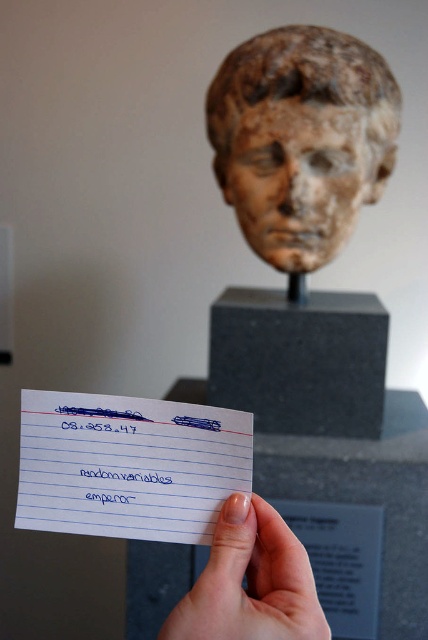
You are a photographer adjusting your camera to focus on the speckled stone head at upper center and the white lined paper at center. Which object should you focus on first if you want to capture both in sharp detail?

You should focus on the speckled stone head at upper center first because it is located above the white lined paper at center, so adjusting focus starting from the higher object ensures both are in sharp detail.

You are an art student analyzing the image. You notice the speckled stone head at upper center and the pale skin at center. Which object is positioned more to the right side of the image?

The speckled stone head at upper center is positioned more to the right side of the image compared to the pale skin at center.

From the picture: Looking at the image, there is a pale skin at center and a blue ink signature at center. Which one is positioned more to the right?

The pale skin at center is positioned more to the right than the blue ink signature at center.